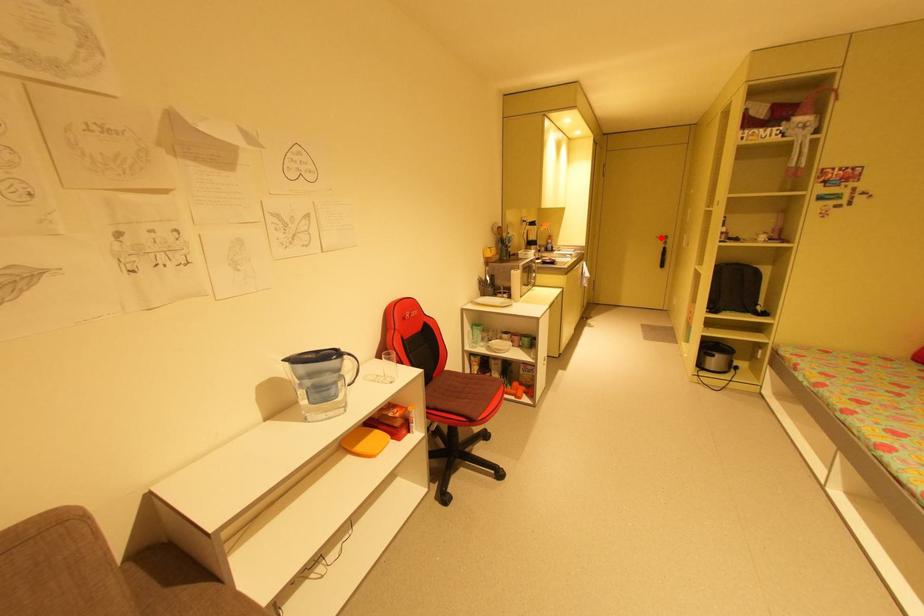
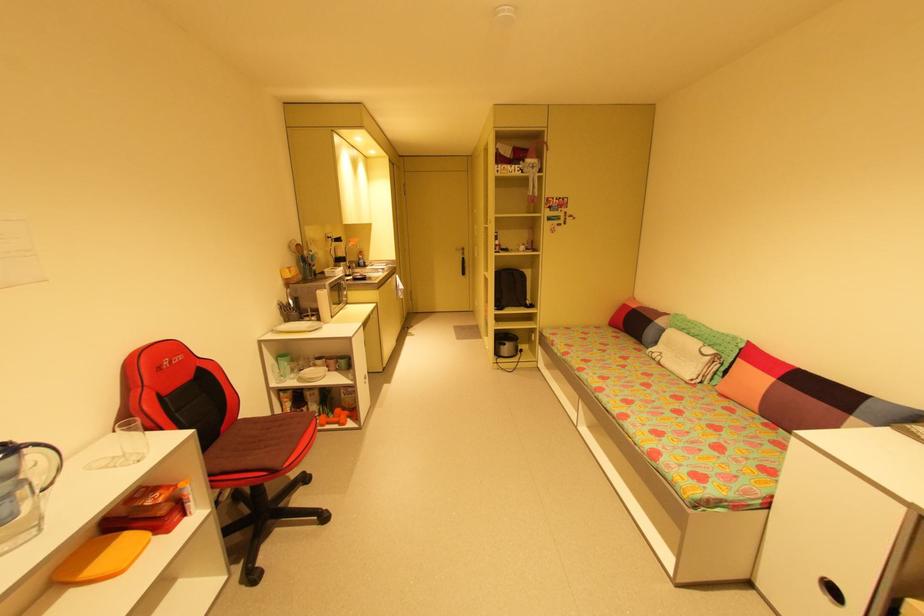
In the second image, find the point that corresponds to the highlighted location in the first image.

(460, 249)